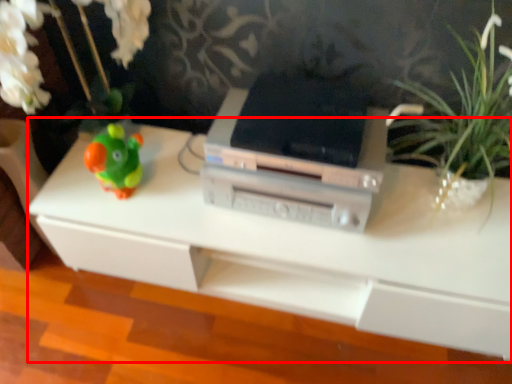
Question: Considering the relative positions of table (annotated by the red box) and printer in the image provided, where is table (annotated by the red box) located with respect to the staircase?

Choices:
 (A) left
 (B) right

Answer: (B)